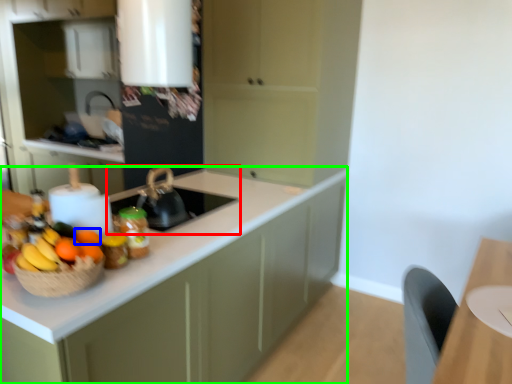
Question: Based on their relative distances, which object is nearer to sink (highlighted by a red box)? Choose from orange (highlighted by a blue box) and cabinetry (highlighted by a green box).

Choices:
 (A) orange
 (B) cabinetry

Answer: (B)